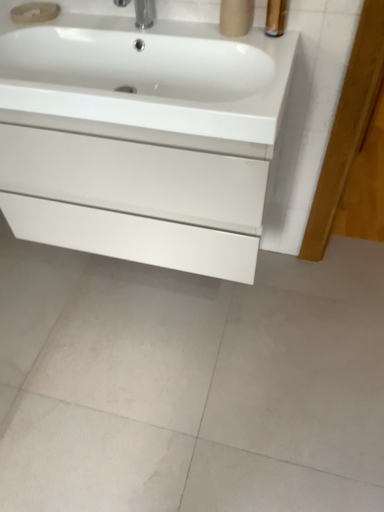
Question: From the image's perspective, would you say white glossy cabinet at center is shown under white glossy sink at upper center?

Choices:
 (A) no
 (B) yes

Answer: (B)

Question: Is white glossy cabinet at center completely or partially outside of white glossy sink at upper center?

Choices:
 (A) no
 (B) yes

Answer: (B)

Question: Is white glossy cabinet at center bigger than white glossy sink at upper center?

Choices:
 (A) yes
 (B) no

Answer: (A)

Question: From the image's perspective, does white glossy cabinet at center appear higher than white glossy sink at upper center?

Choices:
 (A) yes
 (B) no

Answer: (B)

Question: Does white glossy cabinet at center have a smaller size compared to white glossy sink at upper center?

Choices:
 (A) yes
 (B) no

Answer: (B)

Question: Does white glossy cabinet at center have a greater width compared to white glossy sink at upper center?

Choices:
 (A) yes
 (B) no

Answer: (B)

Question: Does white glossy sink at upper center turn towards white glossy cabinet at center?

Choices:
 (A) no
 (B) yes

Answer: (A)

Question: Can you confirm if white glossy sink at upper center is positioned to the right of white glossy cabinet at center?

Choices:
 (A) yes
 (B) no

Answer: (B)

Question: From the image's perspective, would you say white glossy sink at upper center is positioned over white glossy cabinet at center?

Choices:
 (A) no
 (B) yes

Answer: (B)

Question: Considering the relative sizes of white glossy sink at upper center and white glossy cabinet at center in the image provided, is white glossy sink at upper center shorter than white glossy cabinet at center?

Choices:
 (A) no
 (B) yes

Answer: (B)

Question: From a real-world perspective, is white glossy sink at upper center located higher than white glossy cabinet at center?

Choices:
 (A) yes
 (B) no

Answer: (A)

Question: Is white glossy sink at upper center placed right next to white glossy cabinet at center?

Choices:
 (A) no
 (B) yes

Answer: (A)

Question: Considering the positions of white glossy sink at upper center and white glossy cabinet at center in the image, is white glossy sink at upper center wider or thinner than white glossy cabinet at center?

Choices:
 (A) thin
 (B) wide

Answer: (B)